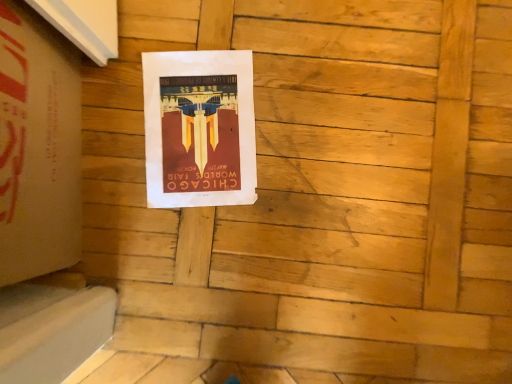
This screenshot has height=384, width=512. What do you see at coordinates (199, 128) in the screenshot?
I see `maroon paper poster at center` at bounding box center [199, 128].

Where is `maroon paper poster at center`? Image resolution: width=512 pixels, height=384 pixels. maroon paper poster at center is located at coordinates (199, 128).

The width and height of the screenshot is (512, 384). What are the coordinates of `maroon paper poster at center` in the screenshot? It's located at (199, 128).